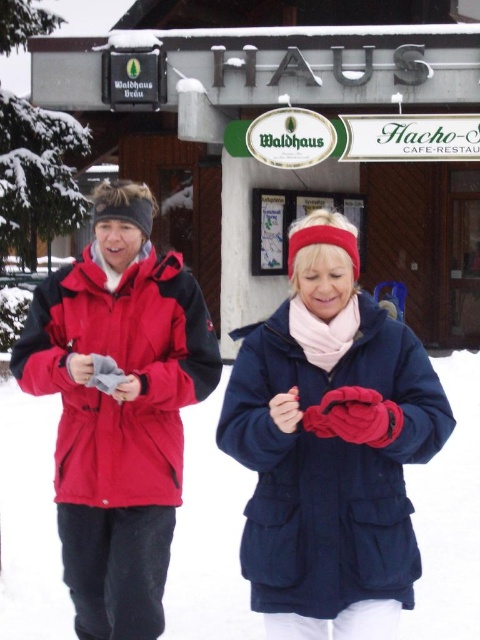
You are trying to locate the matte red jacket at center in the snowy scene. According to the coordinates provided, where would you look first?

You should look at point (332,445) to find the matte red jacket at center.

Consider the image. You are planning to take a photo of the two jackets in the scene. Which jacket, the navy blue cotton jacket at center or the matte red jacket at left, would appear smaller in the photo?

The navy blue cotton jacket at center has a lesser height compared to the matte red jacket at left, so it would appear smaller in the photo.

You are standing in a snowy mountain area and see the matte red jacket at center. If you want to reach it within 3 seconds, what is the minimum speed you need to move at in feet per second?

The matte red jacket at center is 10.03 feet away. To reach it in 3 seconds, the minimum speed required is distance divided by time, so 10.03 feet divided by 3 seconds equals approximately 3.34 feet per second.